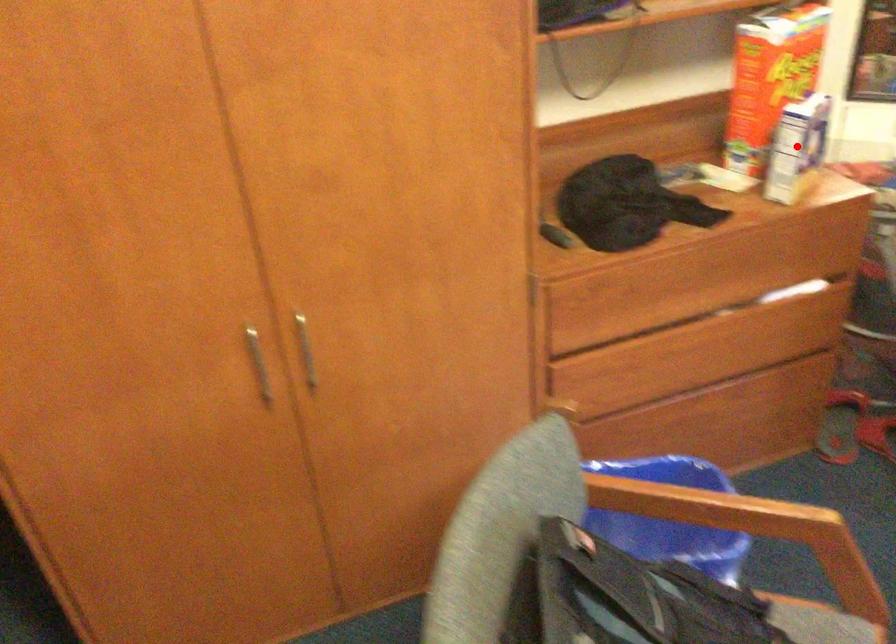
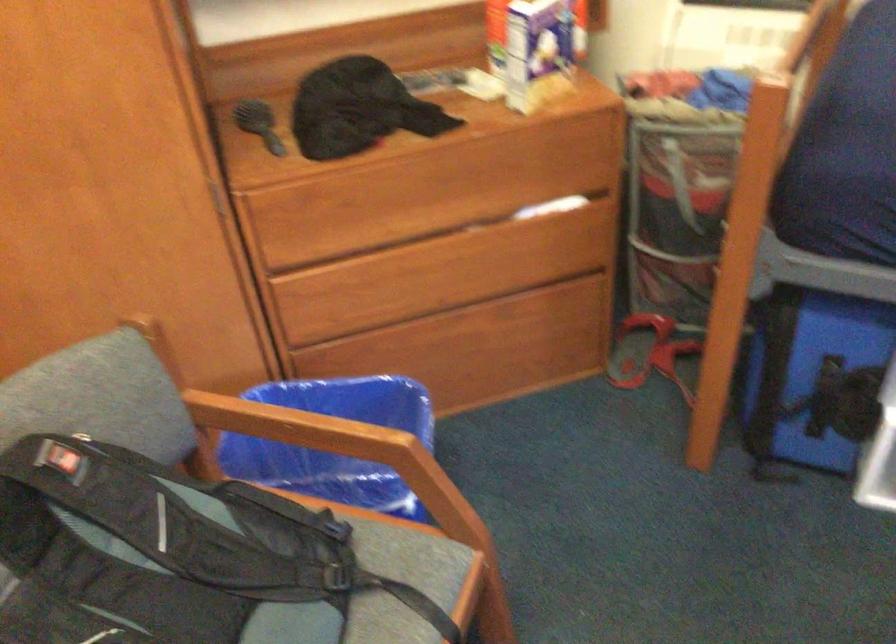
The point at the highlighted location is marked in the first image. Where is the corresponding point in the second image?

(531, 50)